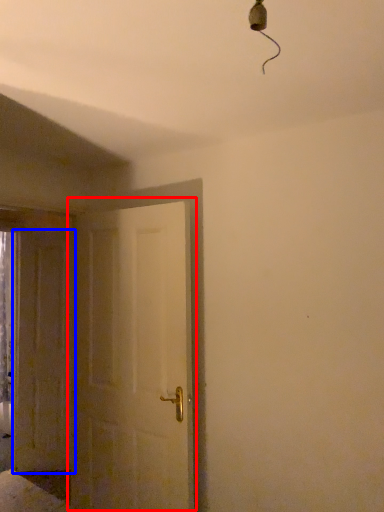
Question: Which point is closer to the camera, door (highlighted by a red box) or door (highlighted by a blue box)?

Choices:
 (A) door
 (B) door

Answer: (A)